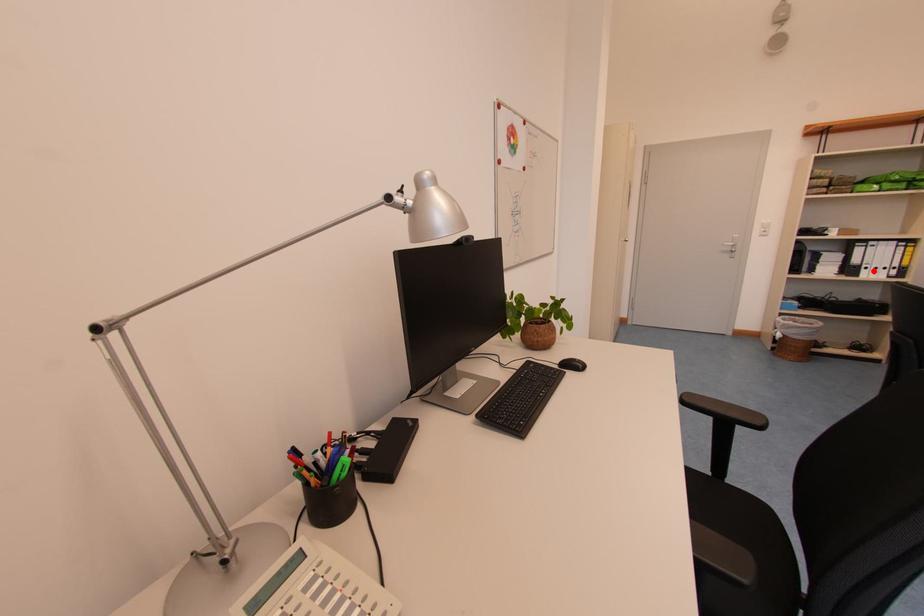
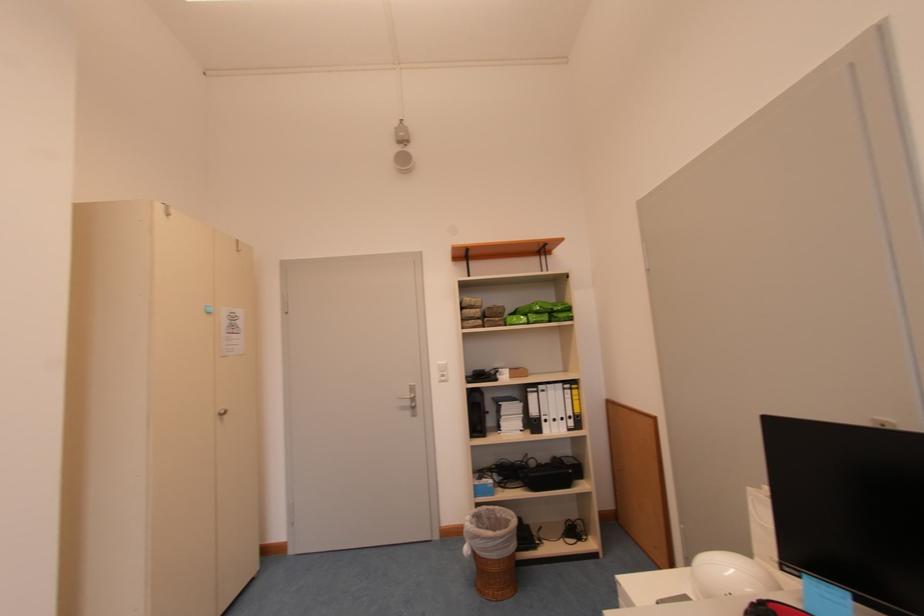
Question: I am providing you with two images of the same scene from different viewpoints. Image1 has a red point marked. In image2, the corresponding 3D location appears at what relative position? Reply with the corresponding letter.

Choices:
 (A) Closer
 (B) Farther

Answer: (B)